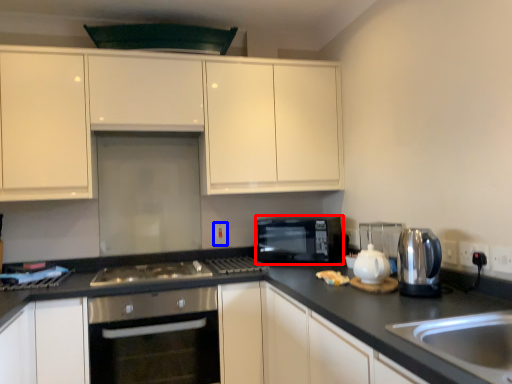
Question: Which of the following is the farthest to the observer, microwave oven (highlighted by a red box) or electric outlet (highlighted by a blue box)?

Choices:
 (A) microwave oven
 (B) electric outlet

Answer: (B)